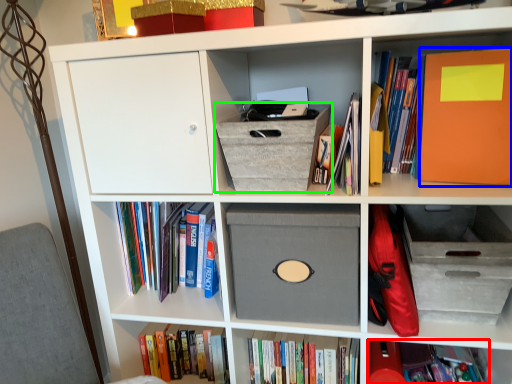
Question: Estimate the real-world distances between objects in this image. Which object is closer to book (highlighted by a red box), paperback book (highlighted by a blue box) or shoe box (highlighted by a green box)?

Choices:
 (A) paperback book
 (B) shoe box

Answer: (A)